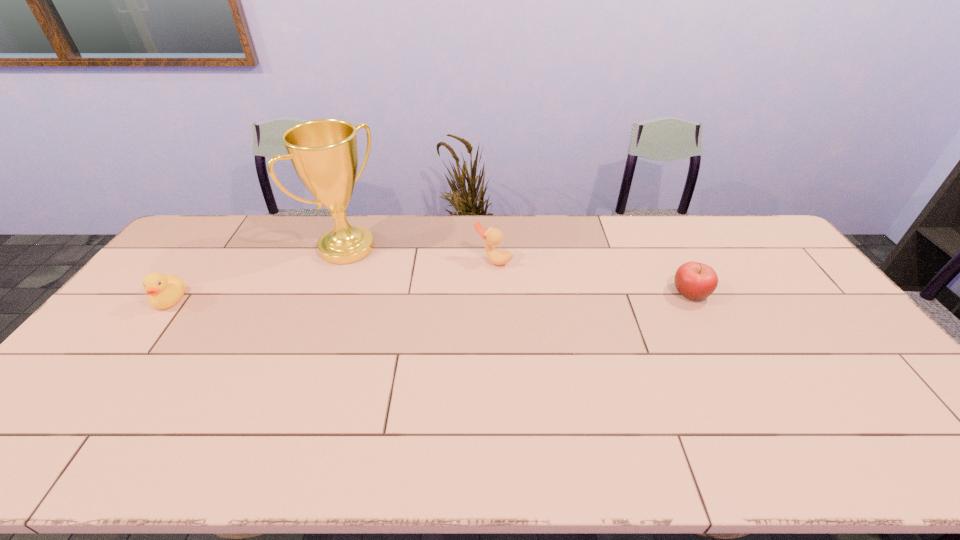
You are a GUI agent. You are given a task and a screenshot of the screen. Output one action in this format:
    pyautogui.click(x=<x>, y=<y>)
    Task: Click on the vacant point located between the leftmost object and the second object from right to left
    The image size is (960, 540).
    Given the screenshot: What is the action you would take?
    coord(331,280)

Identify which object is the second closest to the leftmost object. Please provide its 2D coordinates. Your answer should be formatted as a tuple, i.e. [(x, y)], where the tuple contains the x and y coordinates of a point satisfying the conditions above.

[(492, 236)]

Where is `object that is the third nearest to the third object from left to right`? The width and height of the screenshot is (960, 540). object that is the third nearest to the third object from left to right is located at coordinates (164, 291).

Find the location of a particular element. free space that satisfies the following two spatial constraints: 1. on the front side of the duck; 2. on the right side of the second object from left to right is located at coordinates (343, 260).

Identify the location of blank space that satisfies the following two spatial constraints: 1. on the front side of the award; 2. on the left side of the apple. (330, 293).